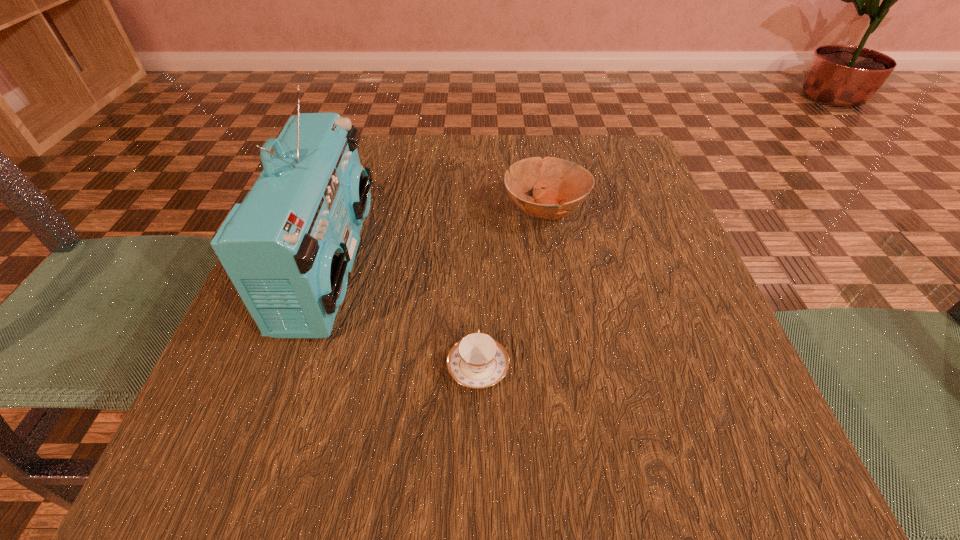
This screenshot has height=540, width=960. I want to click on the leftmost object, so click(288, 247).

You are a GUI agent. You are given a task and a screenshot of the screen. Output one action in this format:
    pyautogui.click(x=<x>, y=<y>)
    Task: Click on the tallest object
    
    Given the screenshot: What is the action you would take?
    pyautogui.click(x=288, y=247)

At what (x,y) coordinates should I click in order to perform the action: click on bowl. Please return your answer as a coordinate pair (x, y). The width and height of the screenshot is (960, 540). Looking at the image, I should click on (567, 184).

The height and width of the screenshot is (540, 960). Find the location of `the second tallest object`. the second tallest object is located at coordinates (567, 184).

Image resolution: width=960 pixels, height=540 pixels. Identify the location of teacup. (477, 361).

The height and width of the screenshot is (540, 960). Identify the location of the second object from right to left. (477, 361).

Locate an element on the screen. free location located on the front-facing side of the radio receiver is located at coordinates (506, 265).

The width and height of the screenshot is (960, 540). I want to click on vacant point located on the front of the rightmost object, so click(553, 259).

You are a GUI agent. You are given a task and a screenshot of the screen. Output one action in this format:
    pyautogui.click(x=<x>, y=<y>)
    Task: Click on the vacant area situated 0.210m on the side with the handle of the second object from left to right
    This screenshot has height=540, width=960.
    Given the screenshot: What is the action you would take?
    pyautogui.click(x=478, y=247)

Identify the location of free space located 0.130m on the side with the handle of the second object from left to right. This screenshot has width=960, height=540. (478, 279).